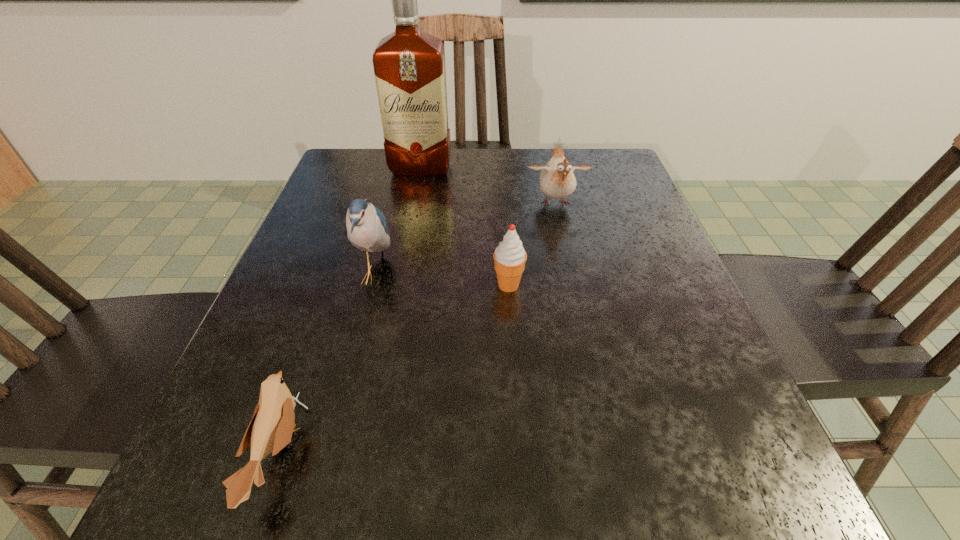
At what (x,y) coordinates should I click in order to perform the action: click on vacant space in between the farthest bird and the liquor. Please return your answer as a coordinate pair (x, y). Looking at the image, I should click on click(488, 186).

You are a GUI agent. You are given a task and a screenshot of the screen. Output one action in this format:
    pyautogui.click(x=<x>, y=<y>)
    Task: Click on the free spot between the leftmost bird and the second object from right to left
    This screenshot has width=960, height=540.
    Given the screenshot: What is the action you would take?
    pyautogui.click(x=394, y=370)

Find the location of a particular element. This screenshot has height=540, width=960. free point between the nearest bird and the tallest object is located at coordinates (349, 311).

Find the location of a particular element. This screenshot has width=960, height=540. empty location between the second tallest bird and the second object from right to left is located at coordinates (532, 245).

At what (x,y) coordinates should I click in order to perform the action: click on vacant area between the rightmost object and the liquor. Please return your answer as a coordinate pair (x, y). The width and height of the screenshot is (960, 540). Looking at the image, I should click on point(488,186).

At what (x,y) coordinates should I click in order to perform the action: click on free point between the fourth object from left to right and the leftmost object. Please return your answer as a coordinate pair (x, y). The width and height of the screenshot is (960, 540). Looking at the image, I should click on (394, 370).

The width and height of the screenshot is (960, 540). I want to click on unoccupied area between the tallest bird and the second object from right to left, so click(442, 280).

You are a GUI agent. You are given a task and a screenshot of the screen. Output one action in this format:
    pyautogui.click(x=<x>, y=<y>)
    Task: Click on the vacant area that lies between the leftmost object and the fourth object from left to right
    
    Given the screenshot: What is the action you would take?
    pyautogui.click(x=394, y=370)

You are a GUI agent. You are given a task and a screenshot of the screen. Output one action in this format:
    pyautogui.click(x=<x>, y=<y>)
    Task: Click on the vacant space that's between the farthest object and the icecream
    Image resolution: width=960 pixels, height=540 pixels.
    Given the screenshot: What is the action you would take?
    pyautogui.click(x=465, y=226)

Locate an element on the screen. The image size is (960, 540). free spot between the tallest object and the nearest object is located at coordinates (349, 311).